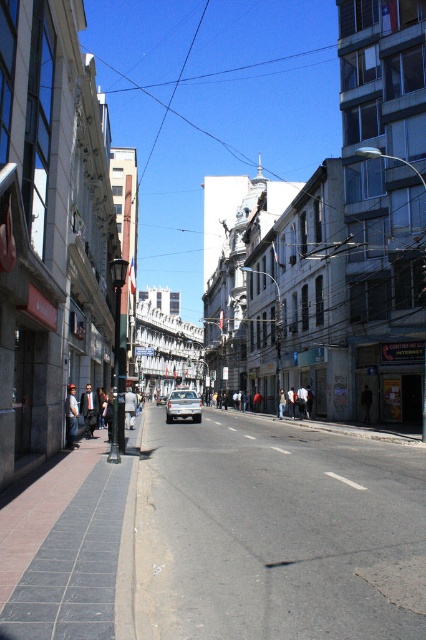
You are standing at the point labeled as point (x=276, y=532) on the image. What is the color of the surface you are currently standing on?

The point (x=276, y=532) indicates gray asphalt road at center, so the surface you are standing on is gray in color.